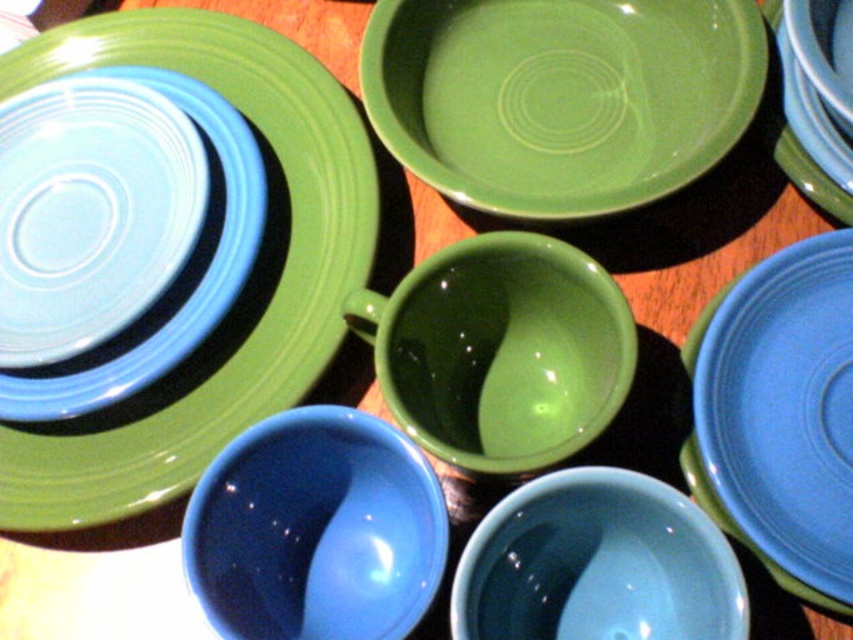
Between blue glossy bowl at lower center and matte blue bowl at lower center, which one has less height?

With less height is matte blue bowl at lower center.

Does blue glossy bowl at lower center have a lesser height compared to matte blue bowl at lower center?

Incorrect, blue glossy bowl at lower center's height does not fall short of matte blue bowl at lower center's.

The width and height of the screenshot is (853, 640). In order to click on blue glossy bowl at lower center in this screenshot , I will do `click(315, 531)`.

Measure the distance from matte blue plate at right to matte blue bowl at lower center.

4.30 inches

Locate an element on the screen. matte blue plate at right is located at coordinates (779, 416).

Identify the location of matte blue plate at right. The image size is (853, 640). (779, 416).

The image size is (853, 640). Describe the element at coordinates (500, 352) in the screenshot. I see `glossy ceramic cup at center` at that location.

I want to click on glossy ceramic cup at center, so click(x=500, y=352).